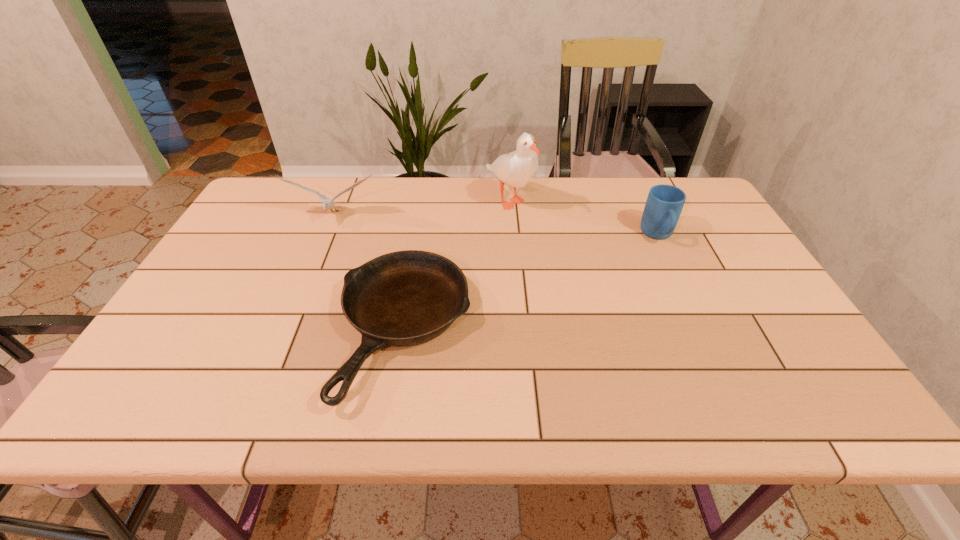
Where is `the right gull`? This screenshot has height=540, width=960. the right gull is located at coordinates (515, 168).

You are a GUI agent. You are given a task and a screenshot of the screen. Output one action in this format:
    pyautogui.click(x=<x>, y=<y>)
    Task: Click on the taller gull
    This screenshot has height=540, width=960.
    Given the screenshot: What is the action you would take?
    pyautogui.click(x=515, y=168)

Image resolution: width=960 pixels, height=540 pixels. What are the coordinates of `the left gull` in the screenshot? It's located at click(x=328, y=203).

Where is `the shorter gull`? The height and width of the screenshot is (540, 960). the shorter gull is located at coordinates (328, 203).

You are a GUI agent. You are given a task and a screenshot of the screen. Output one action in this format:
    pyautogui.click(x=<x>, y=<y>)
    Task: Click on the rightmost object
    This screenshot has height=540, width=960.
    Given the screenshot: What is the action you would take?
    pyautogui.click(x=664, y=204)

The width and height of the screenshot is (960, 540). I want to click on mug, so point(664,204).

Identify the location of frying pan. pyautogui.click(x=405, y=298).

This screenshot has width=960, height=540. Identify the location of the nearest object. click(405, 298).

The height and width of the screenshot is (540, 960). I want to click on free point located at the beak of the right gull, so click(x=518, y=298).

You are a GUI agent. You are given a task and a screenshot of the screen. Output one action in this format:
    pyautogui.click(x=<x>, y=<y>)
    Task: Click on the vacant region located at the tip of the beak of the second tallest object
    
    Given the screenshot: What is the action you would take?
    pyautogui.click(x=296, y=309)